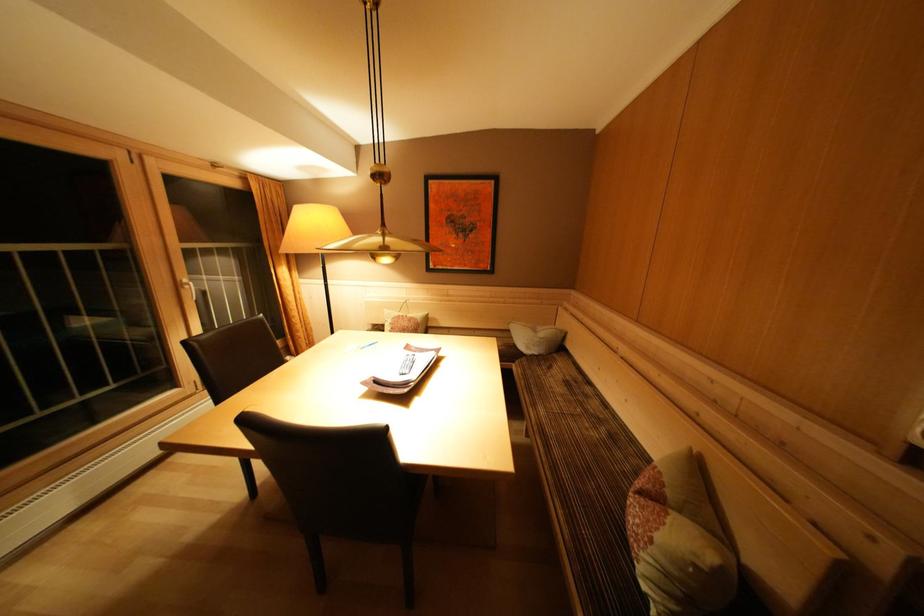
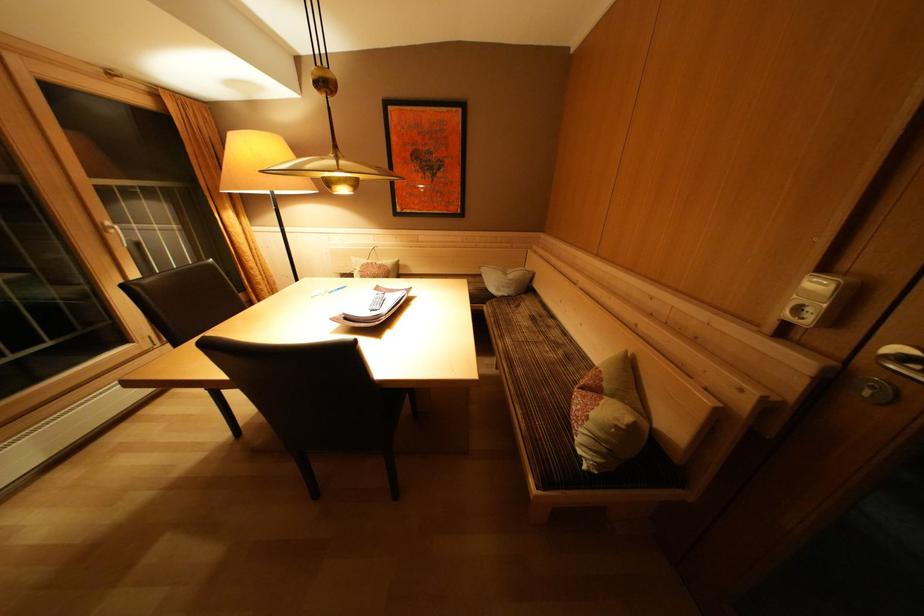
Locate, in the second image, the point that corresponds to [409,321] in the first image.

(379, 268)